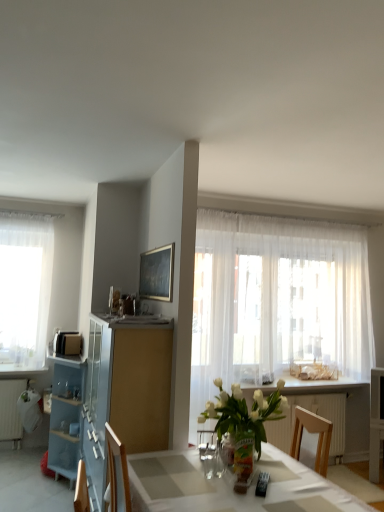
This screenshot has height=512, width=384. In order to click on vacant area that is in front of white glass vase at center in this screenshot , I will do coord(263,492).